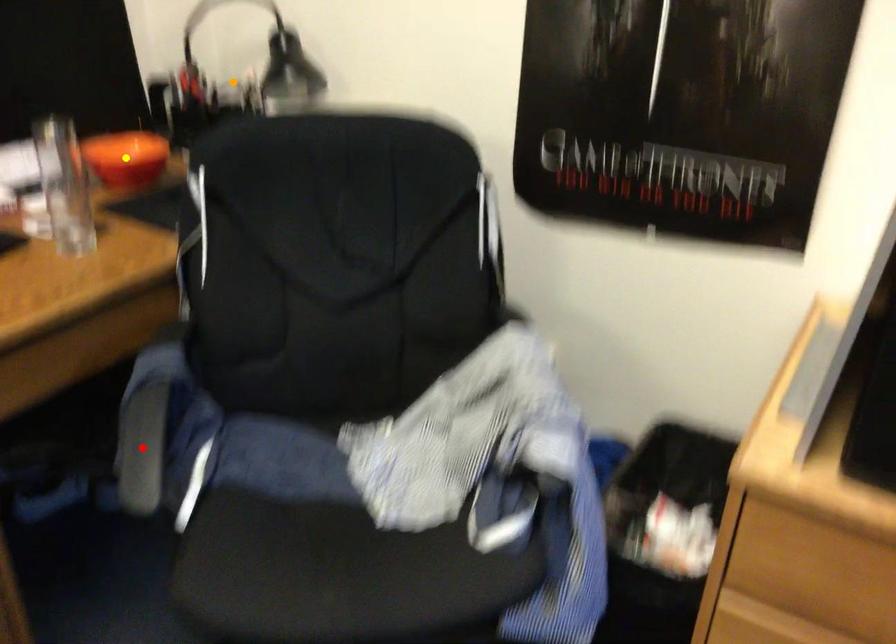
Order these from nearest to farthest:
- orange point
- yellow point
- red point

red point < yellow point < orange point